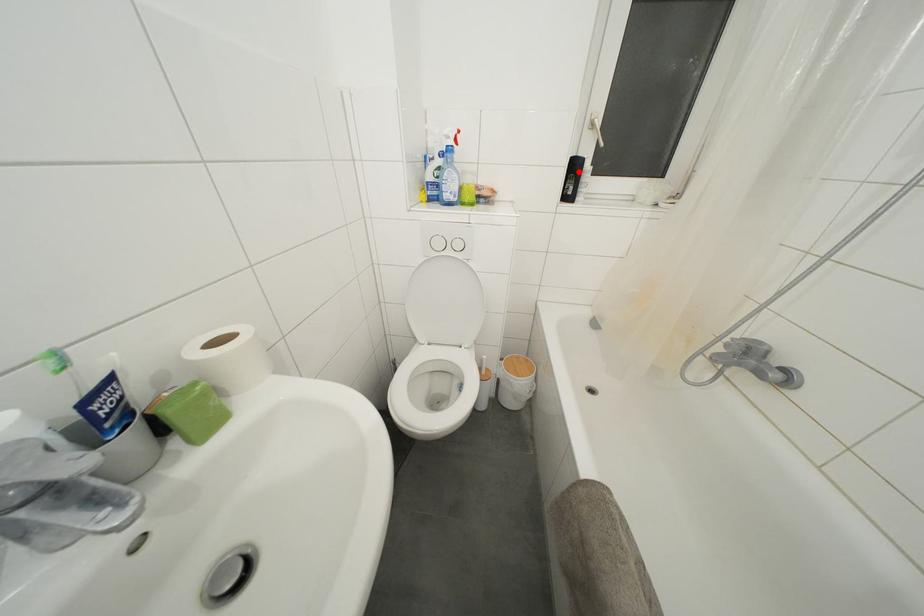
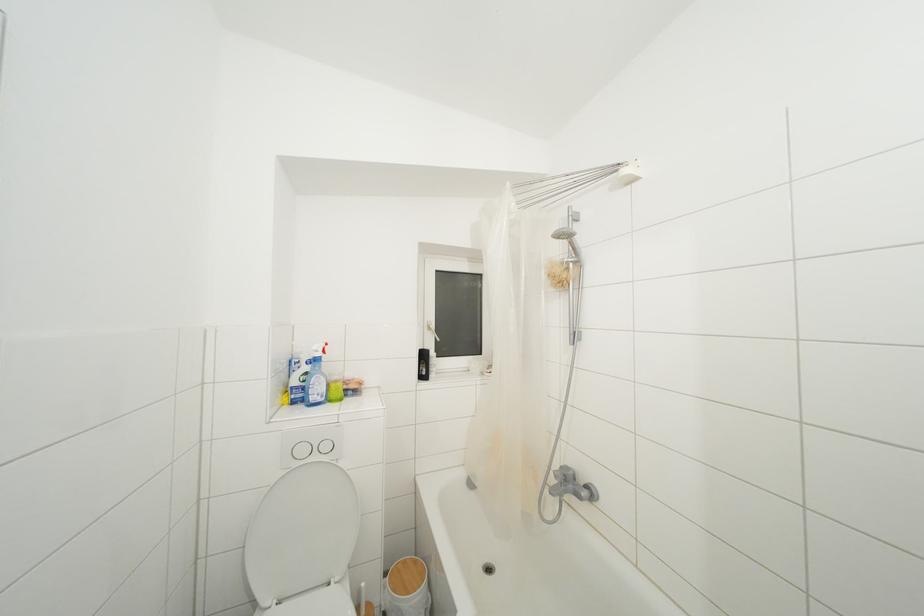
Question: I am providing you with two images of the same scene from different viewpoints. A red point is shown in image1. For the corresponding object point in image2, is it positioned nearer or farther from the camera?

Choices:
 (A) Nearer
 (B) Farther

Answer: (B)